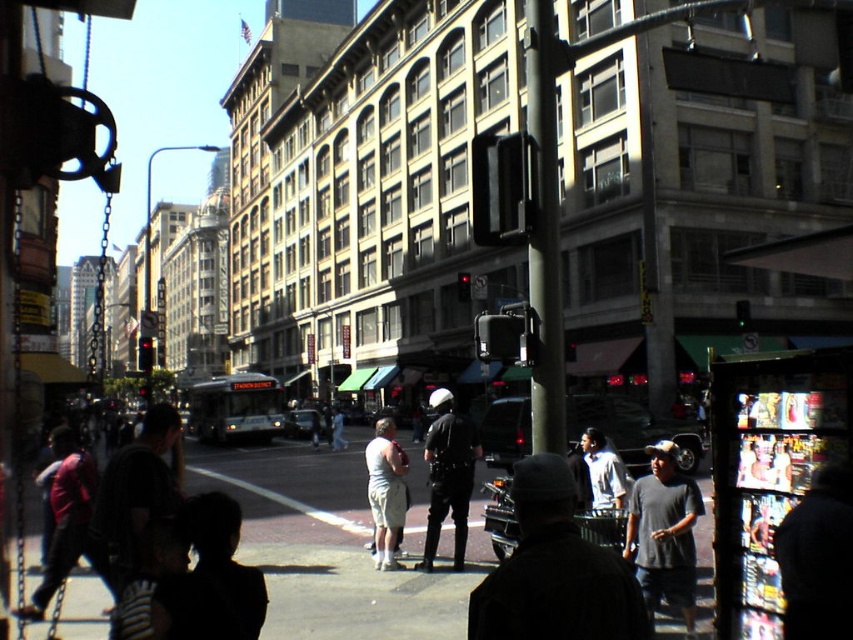
Looking at this image, you are standing on the sidewalk in the urban street scene. You see a dark blue jacket at lower right and a light beige shorts at center. Which object is positioned further to the east?

The dark blue jacket at lower right is positioned further to the east because it is to the right of the light beige shorts at center, and in the image, east would typically be to the right side.

You are a fashion designer observing people on the street. You notice two individuals wearing a dark blue jacket at lower right and a light gray shirt at center. Which clothing item appears to be smaller in size?

The dark blue jacket at lower right is smaller than the light gray shirt at center.